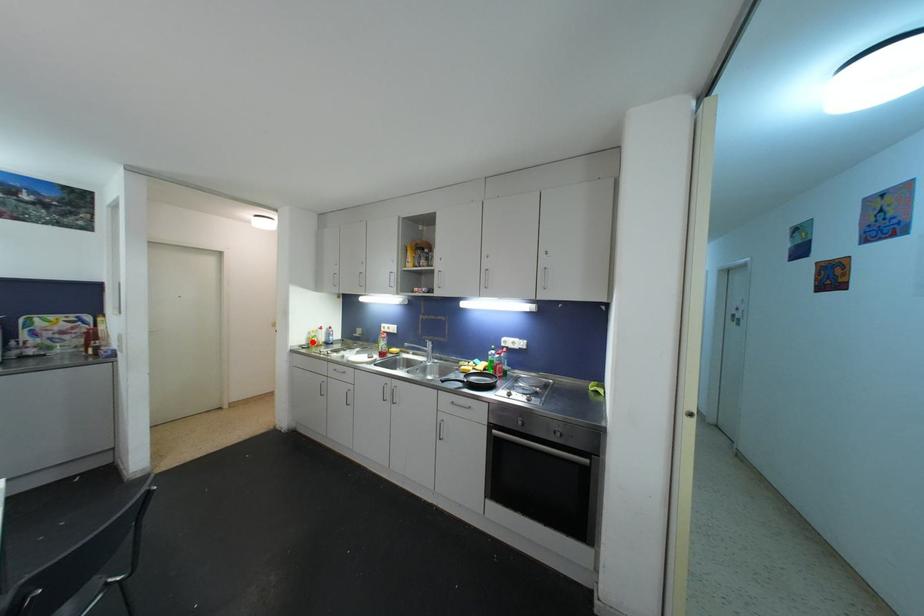
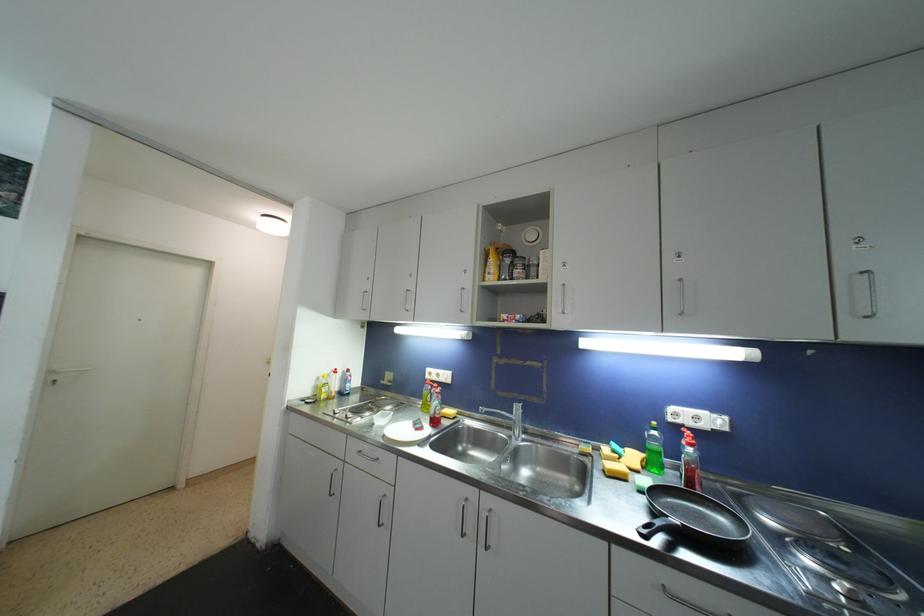
Locate, in the second image, the point that corresponds to the highlighted location in the first image.

(321, 391)